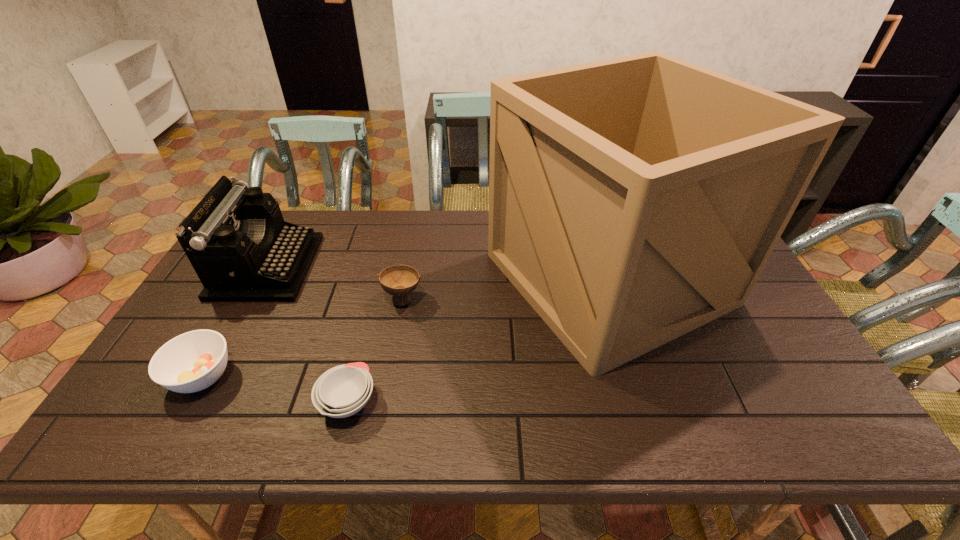
Locate an element on the screen. This screenshot has height=540, width=960. vacant area located 0.260m on the front of the farthest soup bowl is located at coordinates [x=386, y=392].

The image size is (960, 540). Identify the location of vacant space situated on the right of the second tallest soup bowl. (377, 376).

At what (x,y) coordinates should I click in order to perform the action: click on vacant region located 0.380m on the left of the shortest soup bowl. Please return your answer as a coordinate pair (x, y). This screenshot has height=540, width=960. Looking at the image, I should click on (156, 402).

The image size is (960, 540). Identify the location of box located at the far edge. (632, 200).

Locate an element on the screen. The width and height of the screenshot is (960, 540). typewriter that is positioned at the far edge is located at coordinates (242, 250).

What are the coordinates of `object present at the near edge` in the screenshot? It's located at pos(342,391).

The width and height of the screenshot is (960, 540). I want to click on typewriter positioned at the left edge, so click(242, 250).

Image resolution: width=960 pixels, height=540 pixels. What are the coordinates of `soup bowl located at the left edge` in the screenshot? It's located at (193, 361).

Where is `object that is at the right edge`? object that is at the right edge is located at coordinates (632, 200).

I want to click on object located at the far left corner, so click(x=242, y=250).